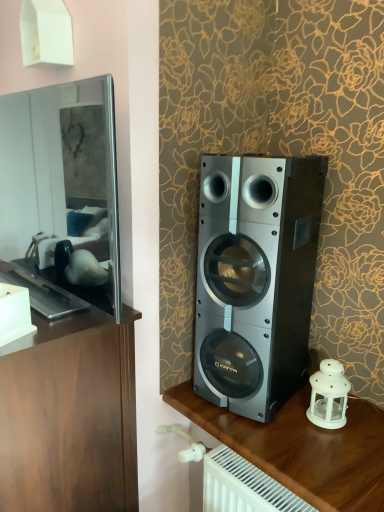
Question: Is white matte lantern at lower right wider or thinner than wooden cabinet at left, the 1th furniture viewed from the left?

Choices:
 (A) wide
 (B) thin

Answer: (B)

Question: Does point (332, 377) appear closer or farther from the camera than point (104, 495)?

Choices:
 (A) closer
 (B) farther

Answer: (B)

Question: Which is nearer to the metallic silver speaker at right, marked as the 2th furniture in a left-to-right arrangement?

Choices:
 (A) wooden cabinet at left, placed as the 2th furniture when sorted from right to left
 (B) white matte lantern at lower right
 (C) matte black mirror at left
 (D) silver metallic speaker at center

Answer: (B)

Question: Which object is the closest to the matte black mirror at left?

Choices:
 (A) wooden cabinet at left, the 1th furniture viewed from the left
 (B) white matte lantern at lower right
 (C) silver metallic speaker at center
 (D) metallic silver speaker at right, acting as the first furniture starting from the right

Answer: (A)